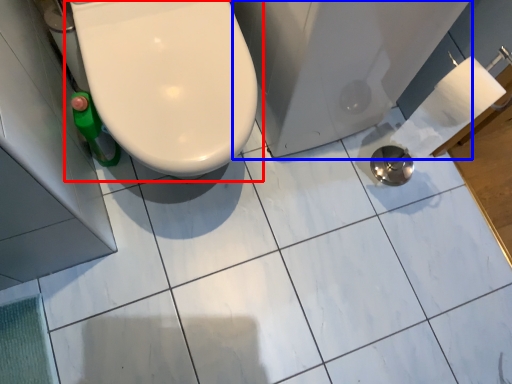
Question: Which object is further to the camera taking this photo, toilet (highlighted by a red box) or bath (highlighted by a blue box)?

Choices:
 (A) toilet
 (B) bath

Answer: (B)